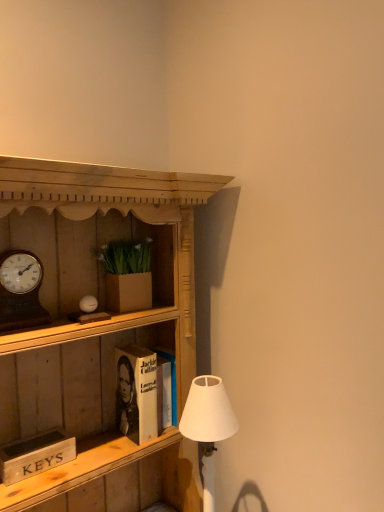
Question: Does wooden cabinet at center touch brown cardboard box at upper center?

Choices:
 (A) yes
 (B) no

Answer: (B)

Question: Can you confirm if wooden cabinet at center is shorter than brown cardboard box at upper center?

Choices:
 (A) yes
 (B) no

Answer: (B)

Question: Is wooden cabinet at center turned away from brown cardboard box at upper center?

Choices:
 (A) no
 (B) yes

Answer: (B)

Question: Can you confirm if wooden cabinet at center is bigger than brown cardboard box at upper center?

Choices:
 (A) no
 (B) yes

Answer: (B)

Question: From the image's perspective, is wooden cabinet at center under brown cardboard box at upper center?

Choices:
 (A) no
 (B) yes

Answer: (B)

Question: Considering the relative sizes of wooden cabinet at center and brown cardboard box at upper center in the image provided, is wooden cabinet at center taller than brown cardboard box at upper center?

Choices:
 (A) yes
 (B) no

Answer: (A)

Question: Is wooden clock at left smaller than white matte lampshade at lower right?

Choices:
 (A) no
 (B) yes

Answer: (B)

Question: Can you confirm if wooden clock at left is taller than white matte lampshade at lower right?

Choices:
 (A) yes
 (B) no

Answer: (B)

Question: Can you confirm if wooden clock at left is shorter than white matte lampshade at lower right?

Choices:
 (A) no
 (B) yes

Answer: (B)

Question: From the image's perspective, is wooden clock at left on white matte lampshade at lower right?

Choices:
 (A) no
 (B) yes

Answer: (B)

Question: Does wooden clock at left have a greater width compared to white matte lampshade at lower right?

Choices:
 (A) yes
 (B) no

Answer: (B)

Question: Are wooden clock at left and white matte lampshade at lower right far apart?

Choices:
 (A) no
 (B) yes

Answer: (A)

Question: Does brown cardboard box at upper center have a greater height compared to wooden cabinet at center?

Choices:
 (A) no
 (B) yes

Answer: (A)